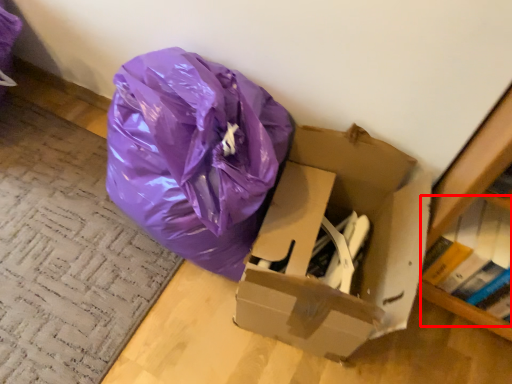
Question: From the image's perspective, where is book (annotated by the red box) located in relation to box in the image?

Choices:
 (A) above
 (B) below

Answer: (B)